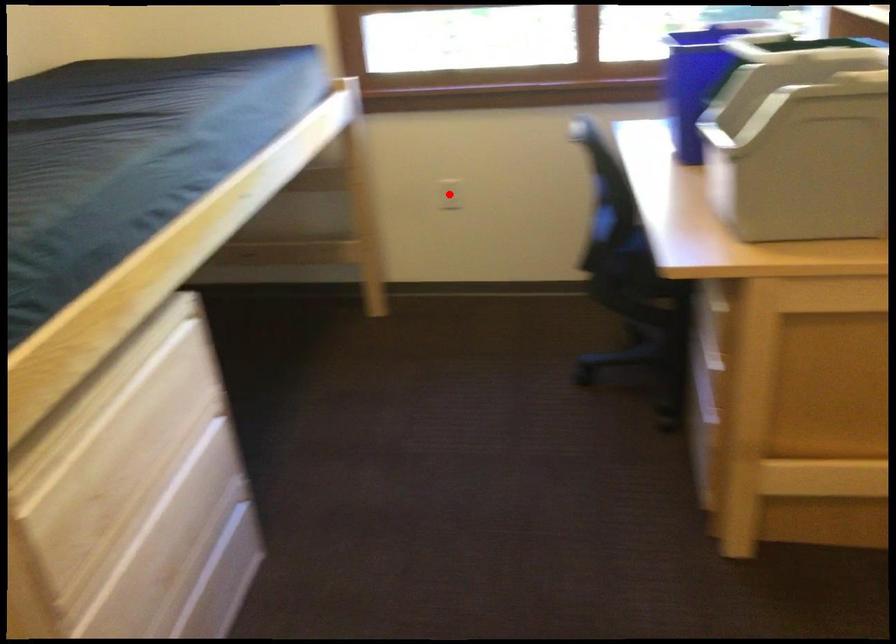
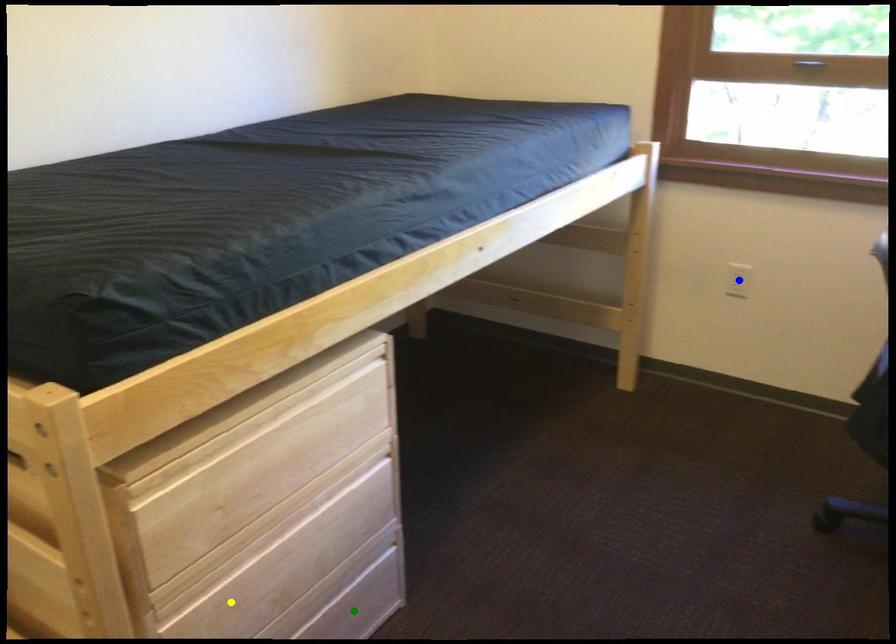
Question: I am providing you with two images of the same scene from different viewpoints. A red point is marked on the first image. You are given multiple points on the second image. Which spot in image 2 lines up with the point in image 1?

Choices:
 (A) blue point
 (B) green point
 (C) yellow point

Answer: (A)